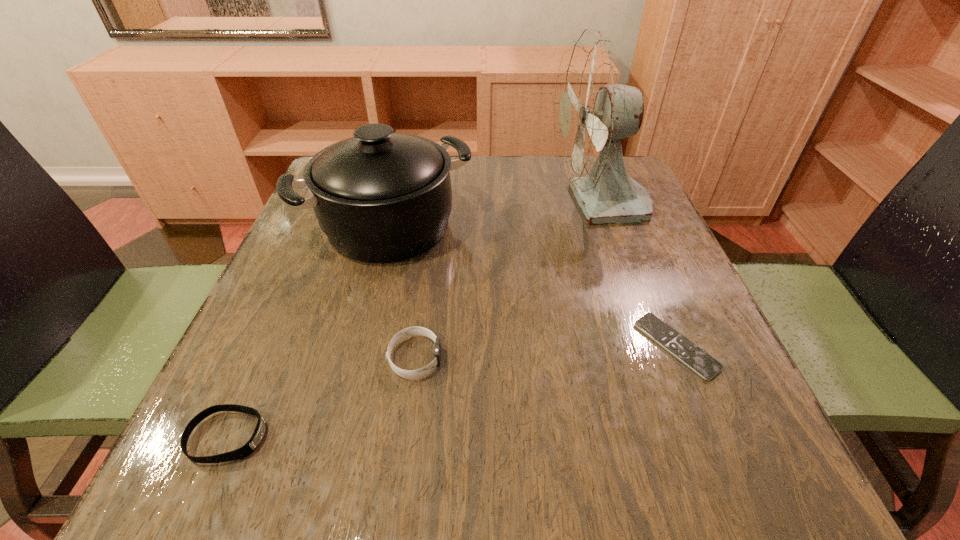
This screenshot has height=540, width=960. What are the coordinates of `object that stands as the second closest to the tallest object` in the screenshot? It's located at (696, 359).

The width and height of the screenshot is (960, 540). What are the coordinates of `free space in the image that satisfies the following two spatial constraints: 1. in front of the fan to blow air; 2. on the back side of the shortest object` in the screenshot? It's located at (650, 346).

Find the location of `free space that satisfies the following two spatial constraints: 1. in front of the tallest object to blow air; 2. on the left side of the shortest object`. free space that satisfies the following two spatial constraints: 1. in front of the tallest object to blow air; 2. on the left side of the shortest object is located at coordinates (650, 346).